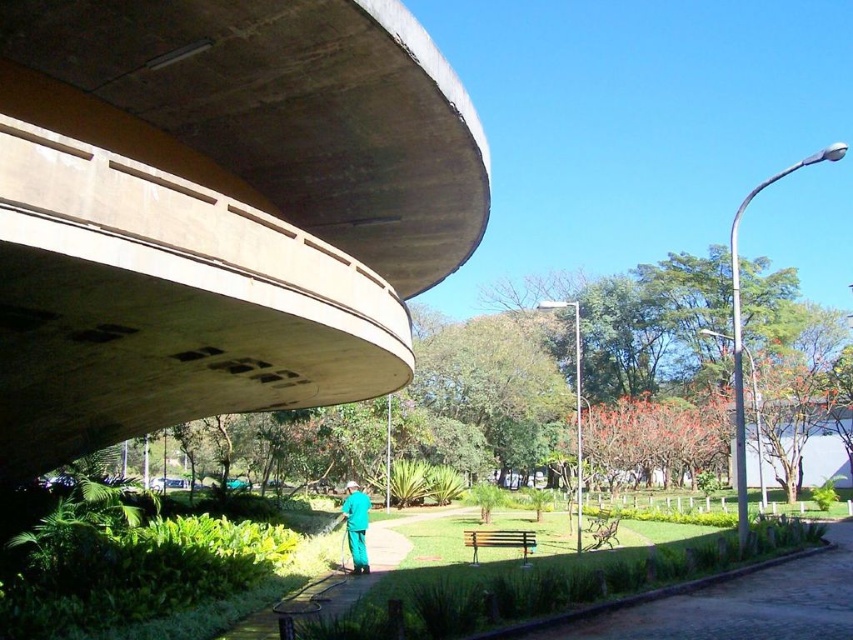
Between green grass at lower center and green matte uniform at center, which one appears on the right side from the viewer's perspective?

From the viewer's perspective, green grass at lower center appears more on the right side.

Which of these two, green grass at lower center or green matte uniform at center, stands taller?

With more height is green matte uniform at center.

Does point (691, 637) come in front of point (352, 520)?

Yes.

Locate an element on the screen. The height and width of the screenshot is (640, 853). green grass at lower center is located at coordinates (730, 604).

Which is more to the right, concrete at upper left or green grass at lower center?

green grass at lower center

Between point (56, 368) and point (682, 627), which one is positioned behind?

Positioned behind is point (56, 368).

Locate an element on the screen. Image resolution: width=853 pixels, height=640 pixels. concrete at upper left is located at coordinates (218, 211).

What do you see at coordinates (218, 211) in the screenshot? I see `concrete at upper left` at bounding box center [218, 211].

Does concrete at upper left appear under green matte uniform at center?

No, concrete at upper left is not below green matte uniform at center.

Between point (368, 205) and point (364, 509), which one is positioned behind?

The point (368, 205) is behind.

At what (x,y) coordinates should I click in order to perform the action: click on concrete at upper left. Please return your answer as a coordinate pair (x, y). This screenshot has height=640, width=853. Looking at the image, I should click on (218, 211).